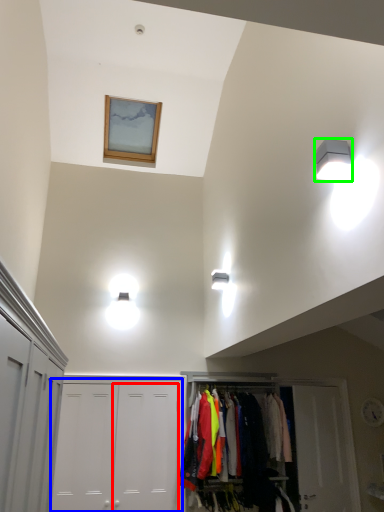
Question: Which is nearer to the door (highlighted by a red box)? door (highlighted by a blue box) or light fixture (highlighted by a green box).

Choices:
 (A) door
 (B) light fixture

Answer: (A)